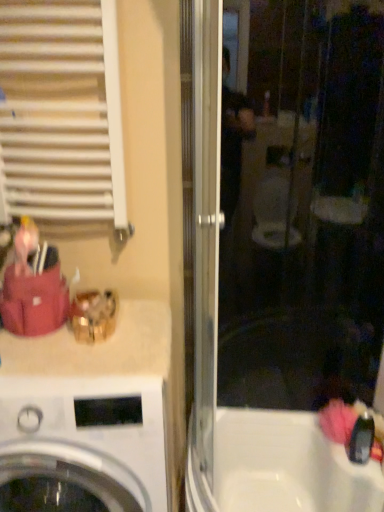
This screenshot has width=384, height=512. I want to click on white matte radiator at upper left, so click(x=61, y=111).

Find the location of a particular element. Image resolution: width=384 pixels, height=512 pixels. white glossy bathtub at lower right is located at coordinates (278, 467).

What do you see at coordinates (82, 443) in the screenshot? This screenshot has width=384, height=512. I see `white glossy washing machine at lower left` at bounding box center [82, 443].

Identify the location of white matte radiator at upper left. The image size is (384, 512). (61, 111).

From the image's perspective, is transparent glass screen door at center above white glossy bathtub at lower right?

Yes, from the image's perspective, transparent glass screen door at center is over white glossy bathtub at lower right.

Considering the sizes of objects transparent glass screen door at center and white glossy bathtub at lower right in the image provided, who is smaller, transparent glass screen door at center or white glossy bathtub at lower right?

white glossy bathtub at lower right.

Considering the sizes of objects transparent glass screen door at center and white glossy bathtub at lower right in the image provided, who is taller, transparent glass screen door at center or white glossy bathtub at lower right?

transparent glass screen door at center is taller.

Which of these two, transparent glass screen door at center or white glossy bathtub at lower right, is thinner?

Thinner between the two is white glossy bathtub at lower right.

Does transparent glass screen door at center appear on the right side of white matte radiator at upper left?

Yes, transparent glass screen door at center is to the right of white matte radiator at upper left.

From a real-world perspective, is transparent glass screen door at center on white matte radiator at upper left?

Actually, transparent glass screen door at center is physically below white matte radiator at upper left in the real world.

Does transparent glass screen door at center touch white matte radiator at upper left?

No.

Is the depth of transparent glass screen door at center greater than that of white matte radiator at upper left?

No, transparent glass screen door at center is closer to the viewer.

Identify the location of shutter above the white glossy washing machine at lower left (from the image's perspective). (61, 111).

From the image's perspective, is white matte radiator at upper left above or below white glossy washing machine at lower left?

white matte radiator at upper left is above white glossy washing machine at lower left.

Consider the image. Is white matte radiator at upper left oriented towards white glossy washing machine at lower left?

No, white matte radiator at upper left is not aimed at white glossy washing machine at lower left.

From the picture: Can you tell me how much white matte radiator at upper left and white glossy washing machine at lower left differ in facing direction?

The angle between the facing direction of white matte radiator at upper left and the facing direction of white glossy washing machine at lower left is 0.0327 degrees.

From a real-world perspective, which object rests below the other?

white glossy washing machine at lower left.

In terms of height, does white glossy washing machine at lower left look taller or shorter compared to white matte radiator at upper left?

Clearly, white glossy washing machine at lower left is taller compared to white matte radiator at upper left.

Is white glossy washing machine at lower left in front of or behind white matte radiator at upper left in the image?

Clearly, white glossy washing machine at lower left is in front of white matte radiator at upper left.

Considering the positions of objects white glossy washing machine at lower left and white matte radiator at upper left in the image provided, who is more to the left, white glossy washing machine at lower left or white matte radiator at upper left?

white matte radiator at upper left is more to the left.

Do you think white glossy bathtub at lower right is within white matte radiator at upper left, or outside of it?

white glossy bathtub at lower right lies outside white matte radiator at upper left.

From the image's perspective, is white glossy bathtub at lower right located beneath white matte radiator at upper left?

Indeed, from the image's perspective, white glossy bathtub at lower right is shown beneath white matte radiator at upper left.

Between white glossy bathtub at lower right and white matte radiator at upper left, which one is positioned behind?

white glossy bathtub at lower right is more distant.

Considering the relative sizes of white glossy bathtub at lower right and transparent glass screen door at center in the image provided, is white glossy bathtub at lower right wider than transparent glass screen door at center?

No.

Can you tell me how much white glossy bathtub at lower right and transparent glass screen door at center differ in facing direction?

The angular difference between white glossy bathtub at lower right and transparent glass screen door at center is 0.712 degrees.

Is transparent glass screen door at center at the back of white glossy bathtub at lower right?

white glossy bathtub at lower right does not have its back to transparent glass screen door at center.

Where is `shutter above the transparent glass screen door at center (from a real-world perspective)`? The height and width of the screenshot is (512, 384). shutter above the transparent glass screen door at center (from a real-world perspective) is located at coordinates (61, 111).

Looking at this image, is white matte radiator at upper left oriented away from transparent glass screen door at center?

No, white matte radiator at upper left is not facing the opposite direction of transparent glass screen door at center.

Considering the positions of objects white matte radiator at upper left and transparent glass screen door at center in the image provided, who is behind, white matte radiator at upper left or transparent glass screen door at center?

white matte radiator at upper left.

At what (x,y) coordinates should I click in order to perform the action: click on screen door on the right of the white glossy bathtub at lower right. Please return your answer as a coordinate pair (x, y). The width and height of the screenshot is (384, 512). Looking at the image, I should click on (216, 362).

The image size is (384, 512). What are the coordinates of `shutter above the transparent glass screen door at center (from a real-world perspective)` in the screenshot? It's located at (61, 111).

Based on their spatial positions, is white glossy bathtub at lower right or transparent glass screen door at center closer to white matte radiator at upper left?

Among the two, transparent glass screen door at center is located nearer to white matte radiator at upper left.

From the image, which object appears to be farther from transparent glass screen door at center, white matte radiator at upper left or white glossy bathtub at lower right?

white matte radiator at upper left lies further to transparent glass screen door at center than the other object.

Which object lies further to the anchor point white glossy bathtub at lower right, transparent glass screen door at center or white glossy washing machine at lower left?

white glossy washing machine at lower left.

Based on their spatial positions, is transparent glass screen door at center or white matte radiator at upper left closer to white glossy bathtub at lower right?

transparent glass screen door at center is positioned closer to the anchor white glossy bathtub at lower right.

Which object lies nearer to the anchor point white glossy washing machine at lower left, white matte radiator at upper left or transparent glass screen door at center?

transparent glass screen door at center is closer to white glossy washing machine at lower left.

Which object lies further to the anchor point white glossy bathtub at lower right, white glossy washing machine at lower left or white matte radiator at upper left?

white matte radiator at upper left is positioned further to the anchor white glossy bathtub at lower right.

Based on their spatial positions, is white glossy bathtub at lower right or white matte radiator at upper left closer to white glossy washing machine at lower left?

Based on the image, white glossy bathtub at lower right appears to be nearer to white glossy washing machine at lower left.

From the image, which object appears to be farther from white glossy washing machine at lower left, white glossy bathtub at lower right or transparent glass screen door at center?

Among the two, white glossy bathtub at lower right is located further to white glossy washing machine at lower left.

The image size is (384, 512). Identify the location of washing machine between transparent glass screen door at center and white glossy bathtub at lower right from front to back. (82, 443).

Identify the location of screen door between white matte radiator at upper left and white glossy washing machine at lower left in the up-down direction. (216, 362).

Image resolution: width=384 pixels, height=512 pixels. What are the coordinates of `washing machine that lies between white matte radiator at upper left and white glossy bathtub at lower right from top to bottom` in the screenshot? It's located at (82, 443).

This screenshot has width=384, height=512. In order to click on screen door between white matte radiator at upper left and white glossy bathtub at lower right in the vertical direction in this screenshot , I will do `click(216, 362)`.